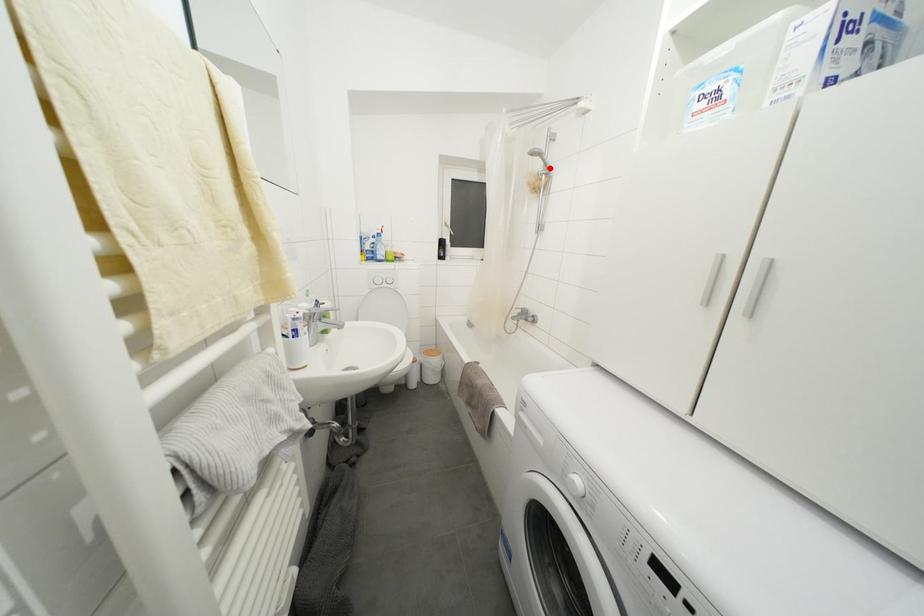
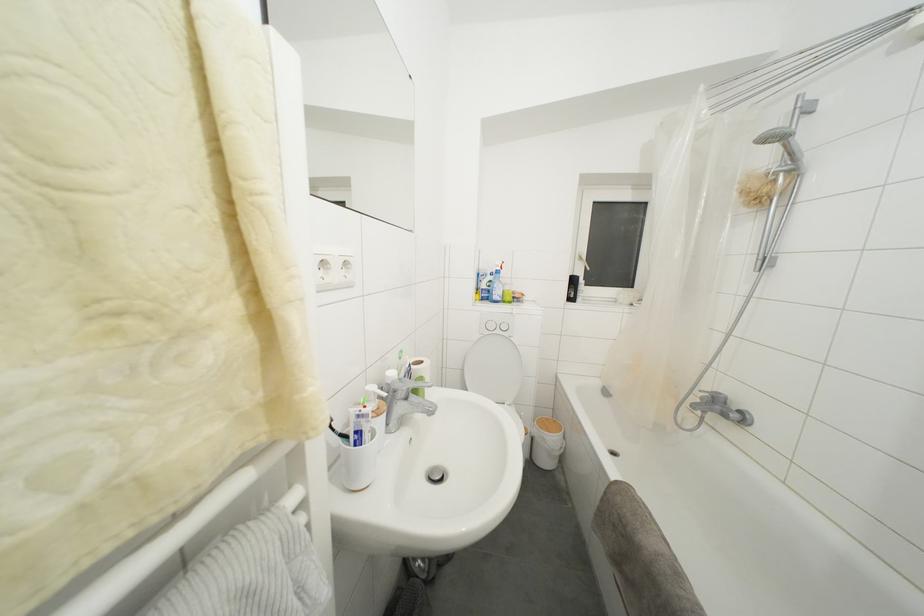
Locate, in the second image, the point that corresponds to the highlighted location in the first image.

(796, 159)